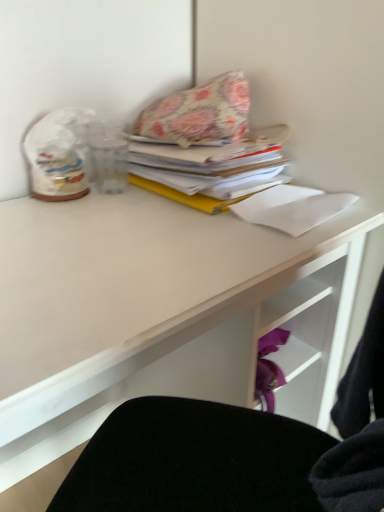
Question: From a real-world perspective, is floral fabric pillow at upper center beneath white matte desk at upper center?

Choices:
 (A) no
 (B) yes

Answer: (A)

Question: From a real-world perspective, is floral fabric pillow at upper center on top of white matte desk at upper center?

Choices:
 (A) no
 (B) yes

Answer: (B)

Question: Is floral fabric pillow at upper center at the left side of white matte desk at upper center?

Choices:
 (A) no
 (B) yes

Answer: (A)

Question: Would you say white matte desk at upper center is part of floral fabric pillow at upper center's contents?

Choices:
 (A) no
 (B) yes

Answer: (A)

Question: Considering the relative positions of floral fabric pillow at upper center and white matte desk at upper center in the image provided, is floral fabric pillow at upper center to the right of white matte desk at upper center from the viewer's perspective?

Choices:
 (A) yes
 (B) no

Answer: (A)

Question: Is floral fabric pillow at upper center next to white matte desk at upper center and touching it?

Choices:
 (A) yes
 (B) no

Answer: (B)

Question: From a real-world perspective, is white matte desk at upper center below floral fabric pillow at upper center?

Choices:
 (A) no
 (B) yes

Answer: (B)

Question: From a real-world perspective, does white matte desk at upper center stand above floral fabric pillow at upper center?

Choices:
 (A) yes
 (B) no

Answer: (B)

Question: Is white matte desk at upper center far from floral fabric pillow at upper center?

Choices:
 (A) no
 (B) yes

Answer: (A)

Question: Does white matte desk at upper center have a greater height compared to floral fabric pillow at upper center?

Choices:
 (A) yes
 (B) no

Answer: (A)

Question: From the image's perspective, is white matte desk at upper center located above floral fabric pillow at upper center?

Choices:
 (A) no
 (B) yes

Answer: (A)

Question: Does white matte desk at upper center have a lesser width compared to floral fabric pillow at upper center?

Choices:
 (A) yes
 (B) no

Answer: (B)

Question: Is white paper at upper right positioned far away from white matte desk at upper center?

Choices:
 (A) no
 (B) yes

Answer: (A)